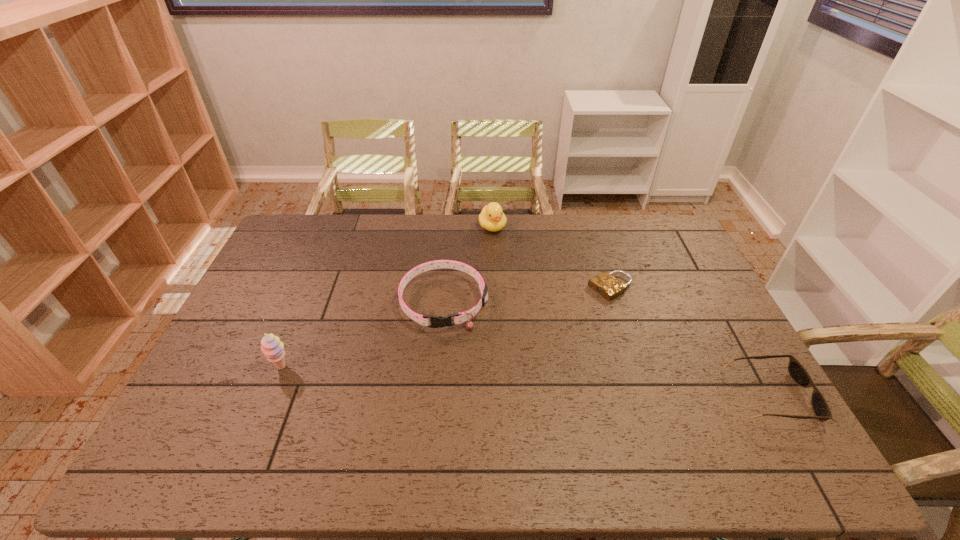
The width and height of the screenshot is (960, 540). I want to click on unoccupied position between the sherbert and the sunglasses, so click(x=526, y=382).

This screenshot has height=540, width=960. What are the coordinates of `free spot between the fourth tallest object and the tallest object` in the screenshot? It's located at pos(526,382).

Find the location of a particular element. The width and height of the screenshot is (960, 540). vacant region between the second shortest object and the padlock is located at coordinates (690, 342).

Find the location of a particular element. vacant area that lies between the third tallest object and the farthest object is located at coordinates (468, 265).

This screenshot has height=540, width=960. I want to click on vacant region between the leftmost object and the padlock, so click(446, 327).

At what (x,y) coordinates should I click in order to perform the action: click on vacant space that is in between the sunglasses and the padlock. Please return your answer as a coordinate pair (x, y). Looking at the image, I should click on (690, 342).

The height and width of the screenshot is (540, 960). Find the location of `free point between the shortest object and the sunglasses`. free point between the shortest object and the sunglasses is located at coordinates (690, 342).

Image resolution: width=960 pixels, height=540 pixels. I want to click on free space between the leftmost object and the dog collar, so click(363, 335).

The image size is (960, 540). Find the location of `object that stands as the third closest to the leftmost object`. object that stands as the third closest to the leftmost object is located at coordinates (605, 284).

Locate an element on the screen. The image size is (960, 540). object that is the second closest one to the dog collar is located at coordinates (273, 349).